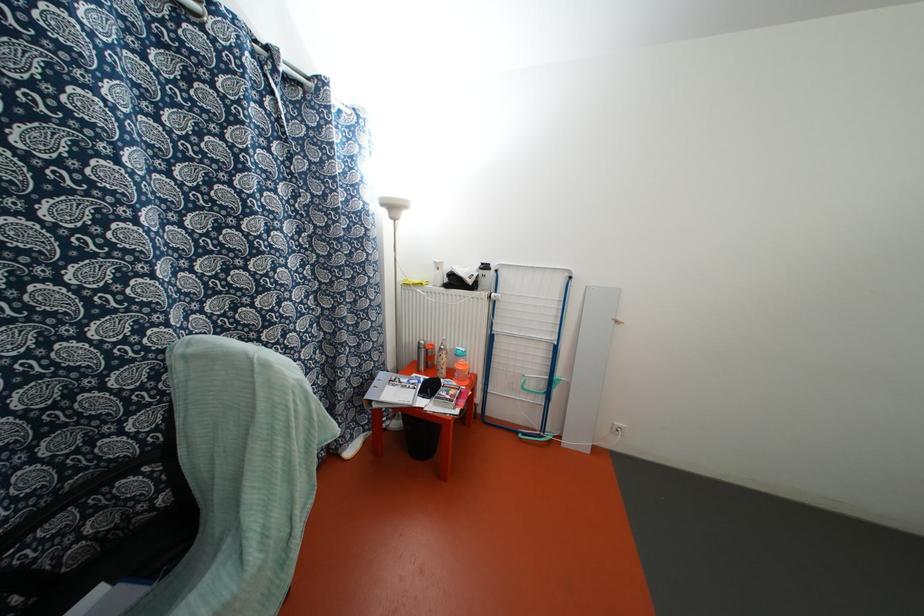
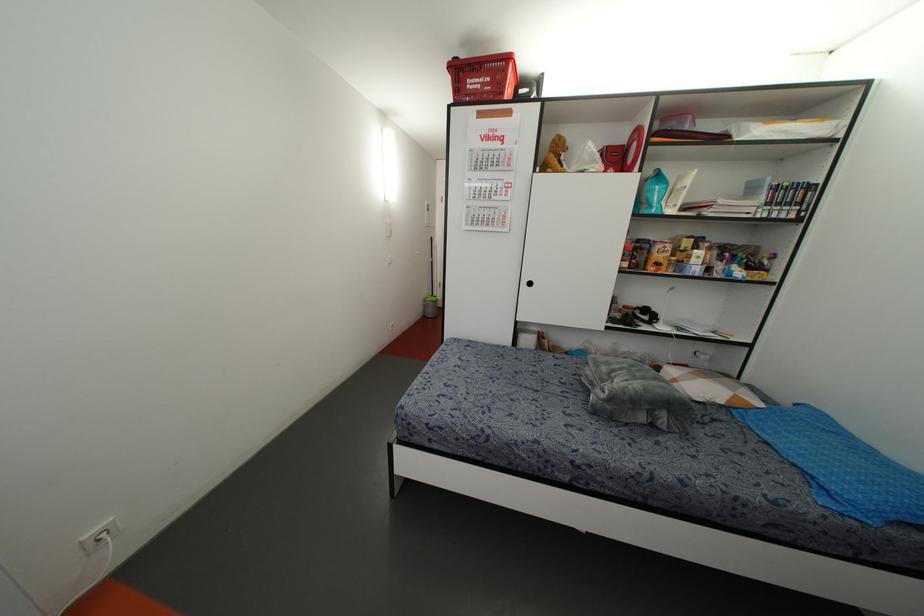
The first image is from the beginning of the video and the second image is from the end. How did the camera likely rotate when shooting the video?

The camera's rotation is toward right-down.